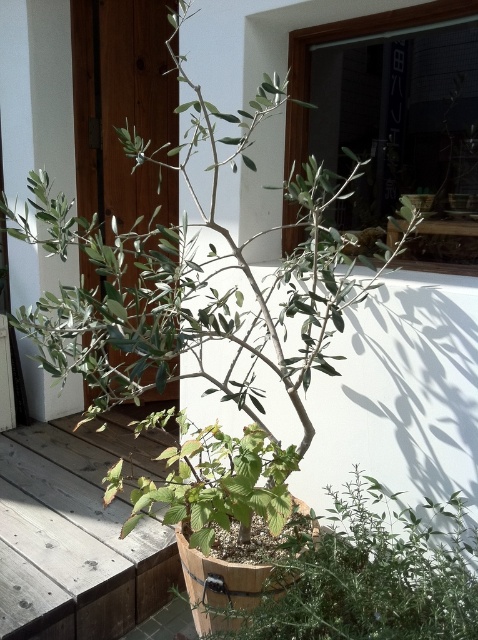
Question: Based on their relative distances, which object is nearer to the gray wood deck at lower left?

Choices:
 (A) green matte plant at center
 (B) green leafy plant at center

Answer: (A)

Question: Which point is farther from the camera taking this photo?

Choices:
 (A) (294, 545)
 (B) (181, 492)
 (C) (91, 513)

Answer: (C)

Question: Is green leafy plant at center above gray wood deck at lower left?

Choices:
 (A) yes
 (B) no

Answer: (A)

Question: Does green leafy plant at center have a greater width compared to green matte plant at center?

Choices:
 (A) yes
 (B) no

Answer: (A)

Question: Which object is the closest to the green matte plant at center?

Choices:
 (A) gray wood deck at lower left
 (B) green leafy plant at center

Answer: (B)

Question: Does green leafy plant at center have a smaller size compared to green matte plant at center?

Choices:
 (A) no
 (B) yes

Answer: (B)